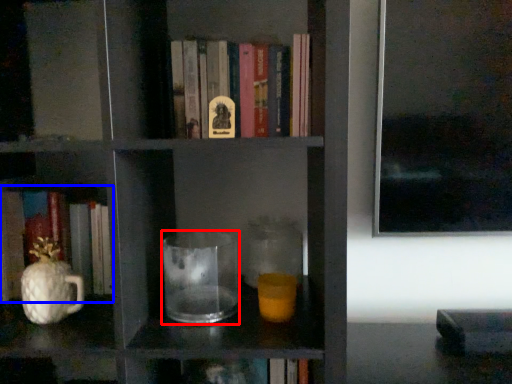
Question: Among these objects, which one is farthest to the camera, jug (highlighted by a red box) or book (highlighted by a blue box)?

Choices:
 (A) jug
 (B) book

Answer: (B)